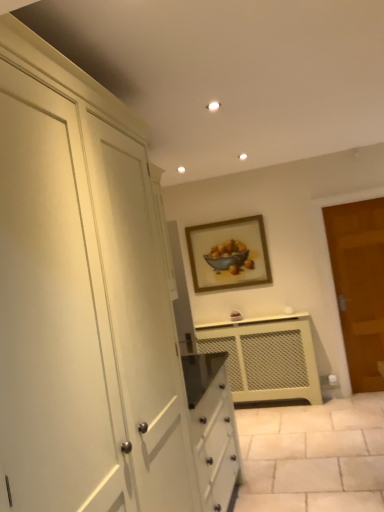
Where is `free point in front of matte cream radiator at center`? This screenshot has height=512, width=384. free point in front of matte cream radiator at center is located at coordinates (289, 433).